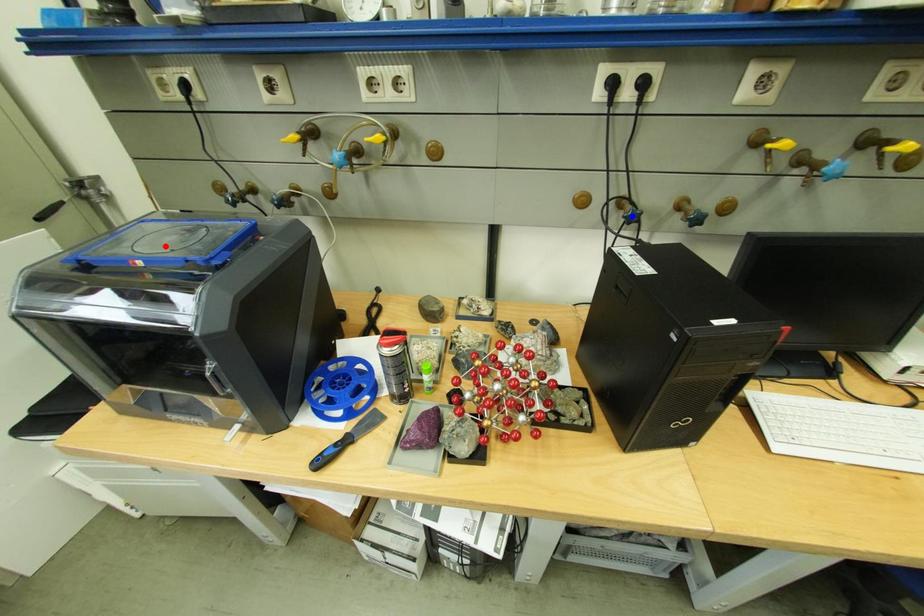
Question: Two points are marked on the image. Which point is closer to the camera?

Choices:
 (A) Blue point is closer.
 (B) Red point is closer.

Answer: (B)